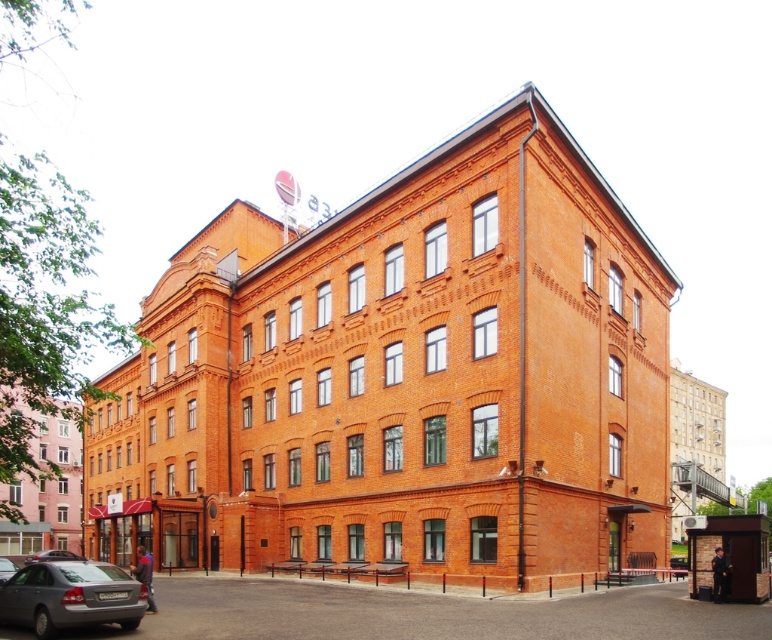
Can you confirm if matte black car at lower left is positioned to the right of metallic gray sedan at lower left?

Incorrect, matte black car at lower left is not on the right side of metallic gray sedan at lower left.

The width and height of the screenshot is (772, 640). Find the location of `matte black car at lower left`. matte black car at lower left is located at coordinates (52, 556).

Is the position of silver metallic car at lower left less distant than that of metallic gray sedan at lower left?

That is True.

Is point (19, 577) farther from camera compared to point (4, 570)?

No, it is in front of (4, 570).

Who is more distant from viewer, [26,593] or [12,572]?

The point [12,572] is behind.

The height and width of the screenshot is (640, 772). Find the location of `silver metallic car at lower left`. silver metallic car at lower left is located at coordinates (70, 596).

Can you confirm if silver metallic car at lower left is taller than matte black car at lower left?

No.

Which is more to the left, silver metallic car at lower left or matte black car at lower left?

Positioned to the left is matte black car at lower left.

What do you see at coordinates (70, 596) in the screenshot?
I see `silver metallic car at lower left` at bounding box center [70, 596].

You are a GUI agent. You are given a task and a screenshot of the screen. Output one action in this format:
    pyautogui.click(x=<x>, y=<y>)
    Task: Click on the silver metallic car at lower left
    The width and height of the screenshot is (772, 640).
    Given the screenshot: What is the action you would take?
    pyautogui.click(x=70, y=596)